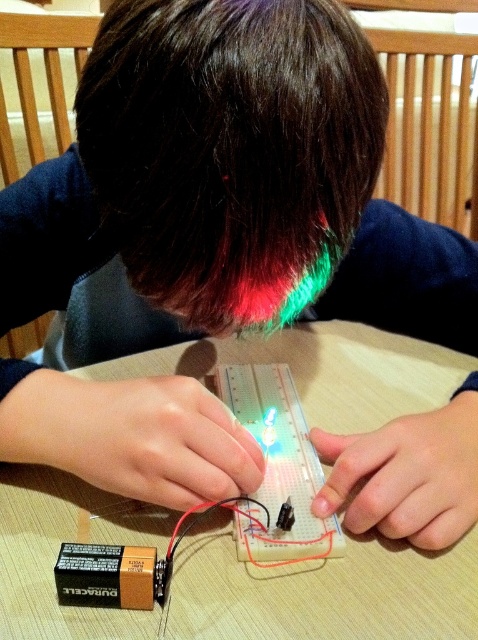
Based on the scene description, what are the coordinates of the dark brown hair at center?

The coordinates of the dark brown hair at center are at point (x=230, y=150).

You are observing a child working on a circuit board. The child has two points of interest marked on the table. One is at point [184,131] and the other at point [327,321]. Which point is closer to you?

Point [184,131] is closer to the camera than point [327,321].